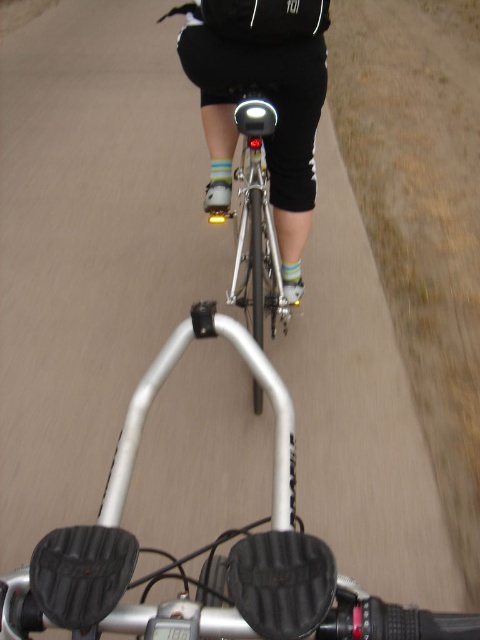
Can you confirm if black matte shorts at center is wider than shiny silver bicycle at center?

Yes, black matte shorts at center is wider than shiny silver bicycle at center.

Is point (225, 65) in front of point (253, 400)?

Yes, it is in front of point (253, 400).

Describe the element at coordinates (265, 97) in the screenshot. This screenshot has width=480, height=640. I see `black matte shorts at center` at that location.

Identify the location of black matte shorts at center. (265, 97).